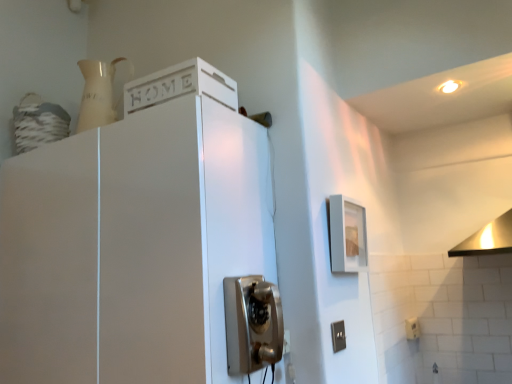
Question: Considering the relative sizes of gray plastic electrical outlet at lower right, positioned as the second electric outlet in right-to-left order, and white matte cabinet at upper left in the image provided, is gray plastic electrical outlet at lower right, positioned as the second electric outlet in right-to-left order, wider than white matte cabinet at upper left?

Choices:
 (A) yes
 (B) no

Answer: (B)

Question: Is gray plastic electrical outlet at lower right, positioned as the second electric outlet in right-to-left order, touching white matte cabinet at upper left?

Choices:
 (A) no
 (B) yes

Answer: (A)

Question: Does gray plastic electrical outlet at lower right, acting as the first electric outlet starting from the front, have a larger size compared to white matte cabinet at upper left?

Choices:
 (A) no
 (B) yes

Answer: (A)

Question: From a real-world perspective, is gray plastic electrical outlet at lower right, positioned as the second electric outlet in right-to-left order, on top of white matte cabinet at upper left?

Choices:
 (A) no
 (B) yes

Answer: (A)

Question: Is gray plastic electrical outlet at lower right, the 2th electric outlet positioned from the back, at the left side of white matte cabinet at upper left?

Choices:
 (A) no
 (B) yes

Answer: (A)

Question: Is white plastic electric outlet at lower right, the 2th electric outlet positioned from the left, inside or outside of white matte cabinet at upper left?

Choices:
 (A) inside
 (B) outside

Answer: (B)

Question: Considering the positions of point (416, 332) and point (263, 236), is point (416, 332) closer or farther from the camera than point (263, 236)?

Choices:
 (A) farther
 (B) closer

Answer: (A)

Question: From a real-world perspective, is white plastic electric outlet at lower right, which ranks as the first electric outlet in back-to-front order, positioned above or below white matte cabinet at upper left?

Choices:
 (A) below
 (B) above

Answer: (A)

Question: Is white plastic electric outlet at lower right, which ranks as the first electric outlet in back-to-front order, wider or thinner than white matte cabinet at upper left?

Choices:
 (A) wide
 (B) thin

Answer: (B)

Question: Relative to white plastic electric outlet at lower right, which ranks as the first electric outlet in back-to-front order, is gray plastic electrical outlet at lower right, the 2th electric outlet positioned from the back, in front or behind?

Choices:
 (A) behind
 (B) front

Answer: (B)

Question: In terms of width, does gray plastic electrical outlet at lower right, the 2th electric outlet positioned from the back, look wider or thinner when compared to white plastic electric outlet at lower right, the second electric outlet when ordered from top to bottom?

Choices:
 (A) thin
 (B) wide

Answer: (A)

Question: In terms of height, does gray plastic electrical outlet at lower right, acting as the first electric outlet starting from the front, look taller or shorter compared to white plastic electric outlet at lower right, marked as the first electric outlet in a bottom-to-top arrangement?

Choices:
 (A) tall
 (B) short

Answer: (A)

Question: From a real-world perspective, is gray plastic electrical outlet at lower right, which is the 2th electric outlet from bottom to top, physically located above or below white plastic electric outlet at lower right, which ranks as the first electric outlet in back-to-front order?

Choices:
 (A) above
 (B) below

Answer: (A)

Question: Looking at the image, does white plastic electric outlet at lower right, which is counted as the 2th electric outlet, starting from the front, seem bigger or smaller compared to metallic vintage phone at center?

Choices:
 (A) small
 (B) big

Answer: (A)

Question: Would you say white plastic electric outlet at lower right, which is counted as the 2th electric outlet, starting from the front, is to the left or to the right of metallic vintage phone at center in the picture?

Choices:
 (A) left
 (B) right

Answer: (B)